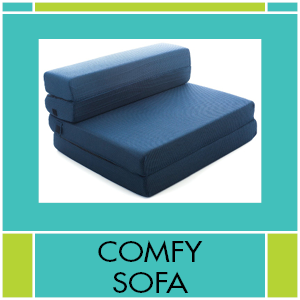
You are a GUI agent. You are given a task and a screenshot of the screen. Output one action in this format:
    pyautogui.click(x=<x>, y=<y>)
    Task: Click on the sofa
    Image resolution: width=300 pixels, height=300 pixels.
    Given the screenshot: What is the action you would take?
    coord(158,277)